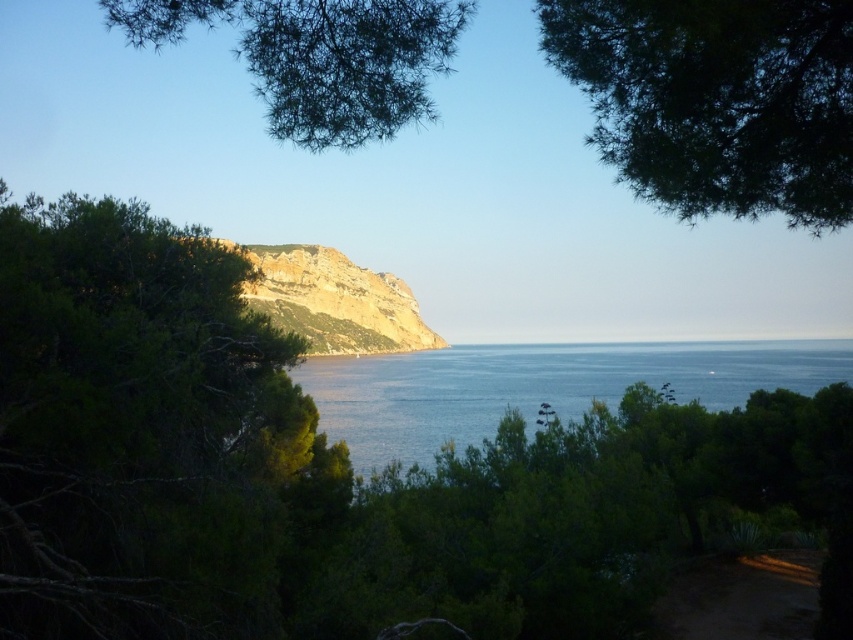
Does green leafy tree at left have a larger size compared to green needle-like leaves at upper center?

Actually, green leafy tree at left might be smaller than green needle-like leaves at upper center.

Which is behind, point (86, 211) or point (405, 33)?

Point (86, 211)

The image size is (853, 640). Identify the location of green leafy tree at left. [x=149, y=436].

Between dark green leafy tree at upper right and green needle-like leaves at upper center, which one appears on the right side from the viewer's perspective?

dark green leafy tree at upper right

In the scene shown: Who is taller, dark green leafy tree at upper right or green needle-like leaves at upper center?

green needle-like leaves at upper center is taller.

Who is more forward, (763, 147) or (299, 147)?

Point (763, 147)

Locate an element on the screen. This screenshot has width=853, height=640. dark green leafy tree at upper right is located at coordinates (717, 100).

Is point (651, 109) closer to viewer compared to point (795, 356)?

That is True.

Which of these two, dark green leafy tree at upper right or blue water at center, stands shorter?

With less height is blue water at center.

Find the location of a particular element. dark green leafy tree at upper right is located at coordinates (717, 100).